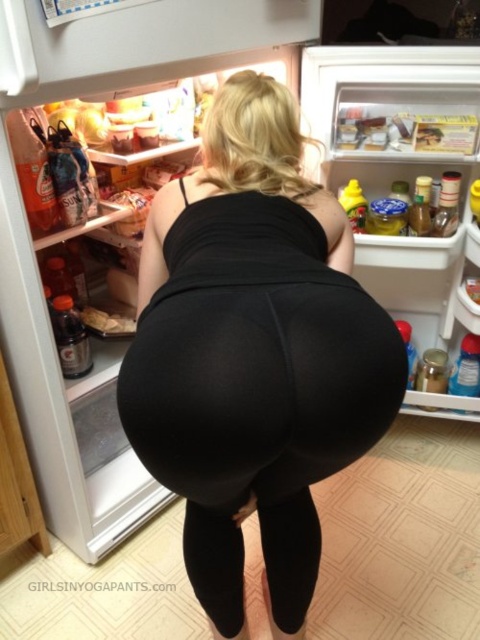
You are an interior designer assessing the layout of a kitchen. You notice two pairs of black leggings in the refrigerator image. Which one, the black matte leggings at center or the black leggings at lower center, appears to be positioned higher?

The black matte leggings at center appears higher because it is taller than the black leggings at lower center.

You are a fashion designer observing the image of a person in front of a refrigerator. You notice two pairs of black leggings. The first is labeled as black matte leggings at center, and the second is black leggings at lower center. Which pair of leggings is positioned higher on the person?

A: The black matte leggings at center is positioned higher on the person than the black leggings at lower center, as it is above the latter according to the description.

You are a fashion designer observing a model in front of an open refrigerator. The model is wearing the black matte leggings at center. If you want to take a photo of the model from directly behind, ensuring the leggings are centered in the frame, where should you position your camera relative to the refrigerator?

The black matte leggings at center are located at point 2D coordinates of [253,355]. To center the leggings in the frame, position the camera directly behind the refrigerator at the same horizontal and vertical alignment as the leggings coordinates.